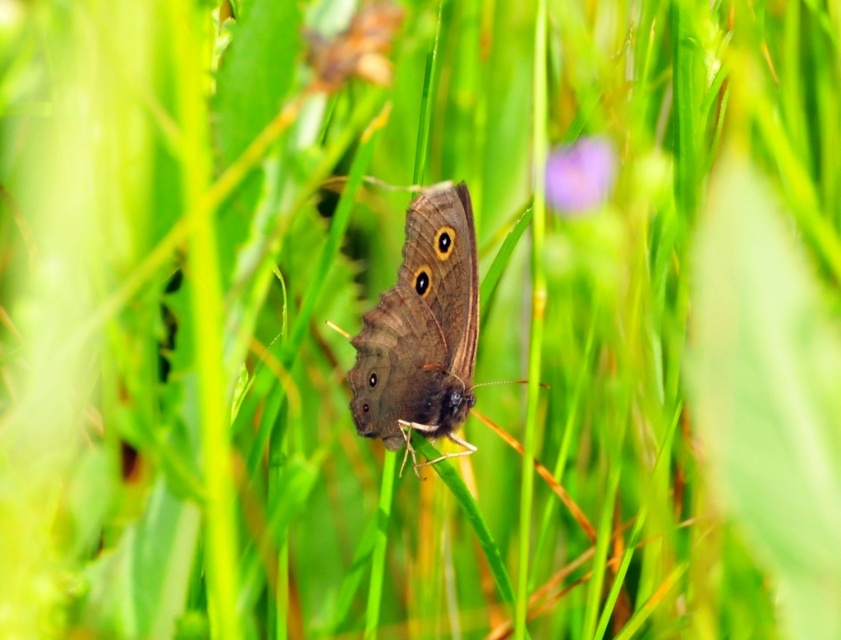
Who is lower down, brown matte butterfly at center or purple matte flower at upper center?

brown matte butterfly at center

Find the location of a particular element. brown matte butterfly at center is located at coordinates (422, 332).

What do you see at coordinates (422, 332) in the screenshot?
I see `brown matte butterfly at center` at bounding box center [422, 332].

Locate an element on the screen. brown matte butterfly at center is located at coordinates pyautogui.click(x=422, y=332).

Does brown matte butterfly at center have a greater width compared to brown textured leaf at upper center?

Yes.

Is brown matte butterfly at center behind brown textured leaf at upper center?

Yes, it is.

In order to click on brown matte butterfly at center in this screenshot , I will do `click(422, 332)`.

I want to click on brown matte butterfly at center, so click(x=422, y=332).

Measure the distance between point (311, 65) and camera.

Point (311, 65) and camera are 30.18 inches apart from each other.

Measure the distance between brown textured leaf at upper center and purple matte flower at upper center.

27.60 inches

Does point (378, 20) lie behind point (585, 195)?

No, (378, 20) is in front of (585, 195).

Locate an element on the screen. Image resolution: width=841 pixels, height=640 pixels. brown textured leaf at upper center is located at coordinates (355, 48).